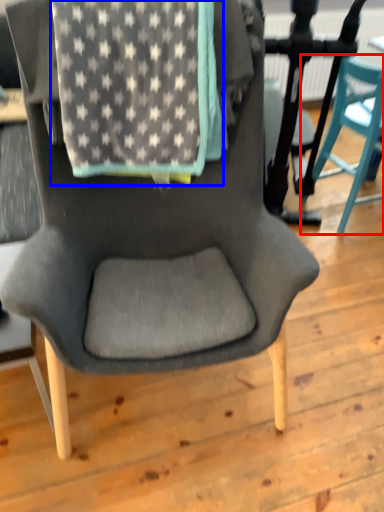
Question: Which point is closer to the camera, chair (highlighted by a red box) or blanket (highlighted by a blue box)?

Choices:
 (A) chair
 (B) blanket

Answer: (B)